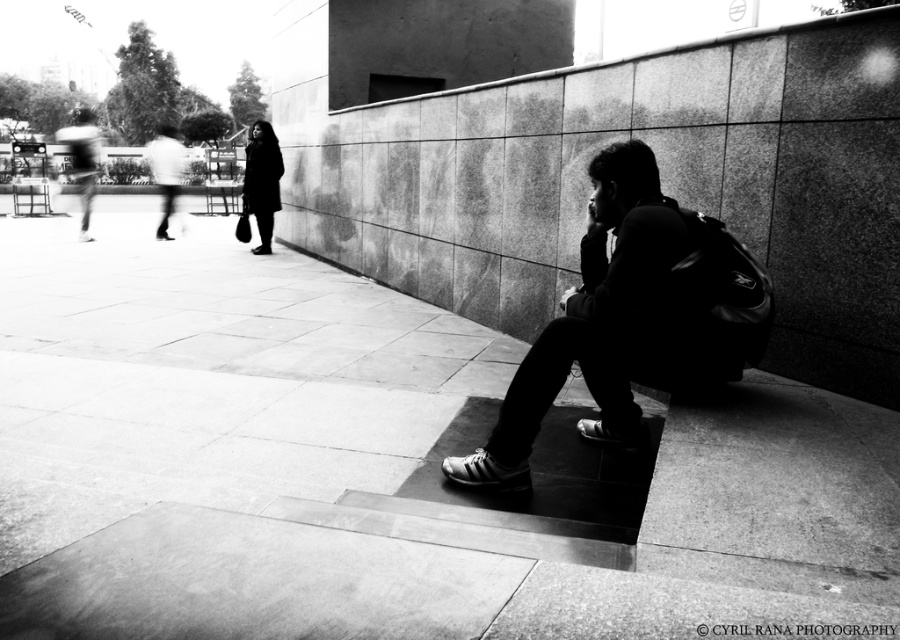
Consider the image. You are a photographer trying to capture the scene from the same angle as the image. You want to place a tripod exactly where the smooth concrete pavement at center is located. What are the coordinates you should input into the tripod placement system?

The coordinates for the smooth concrete pavement at center are at point (385, 468), so you should input those into the tripod placement system.

You are standing at the point labeled point (x=592, y=282) and want to move to the point labeled point (x=504, y=340). Given that the path between them is clear, which direction should you move relative to the original position?

You should move forward because point (x=504, y=340) is behind point (x=592, y=282), meaning it is in the forward direction from your current position.

You are a delivery person who needs to place a package on the smooth concrete pavement at center. Can you do so without the package falling off, considering the black leather backpack at center?

The smooth concrete pavement at center is shorter than the black leather backpack at center, so placing the package there might be unstable because the pavement is lower than the backpack. Check if there is a higher or more level surface available.